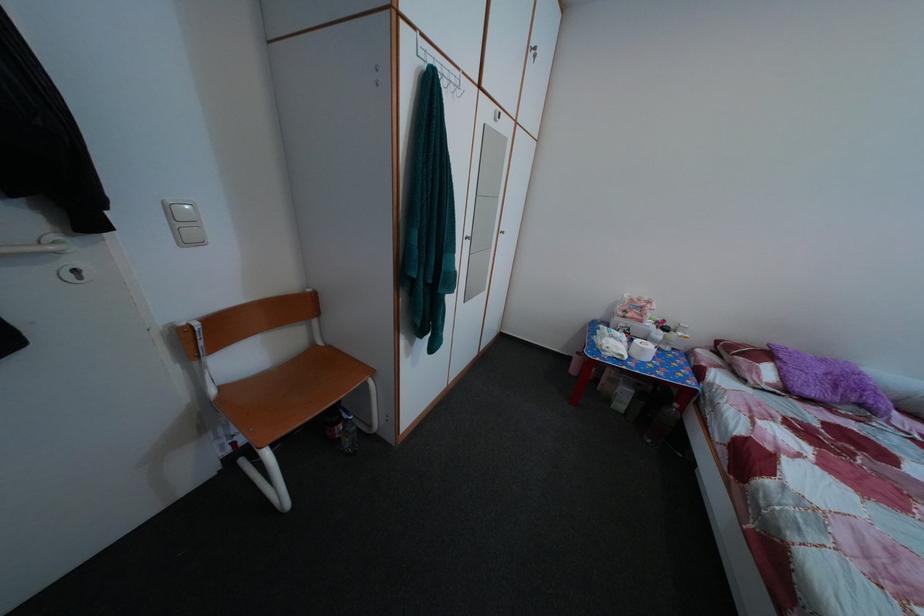
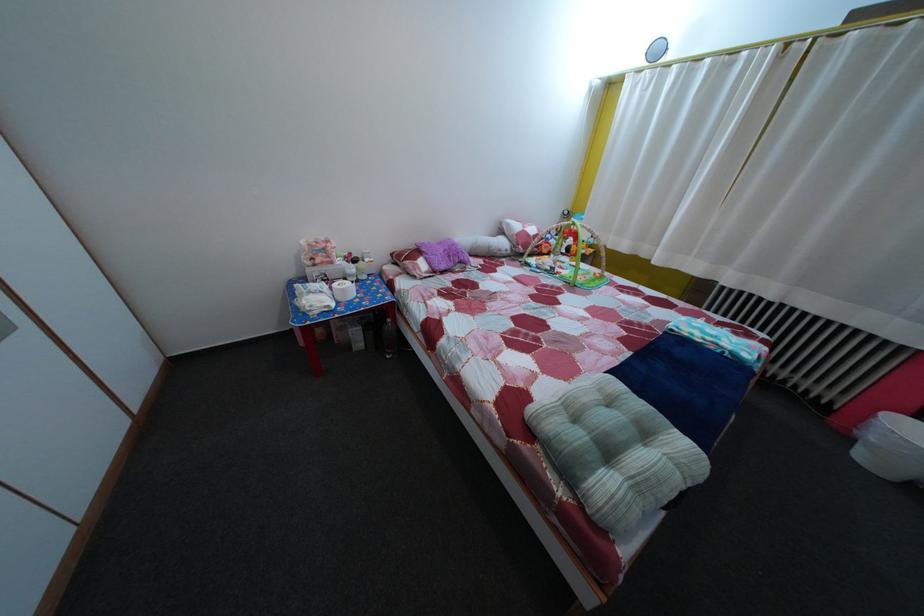
The first image is from the beginning of the video and the second image is from the end. How did the camera likely rotate when shooting the video?

The camera rotated toward right-down.